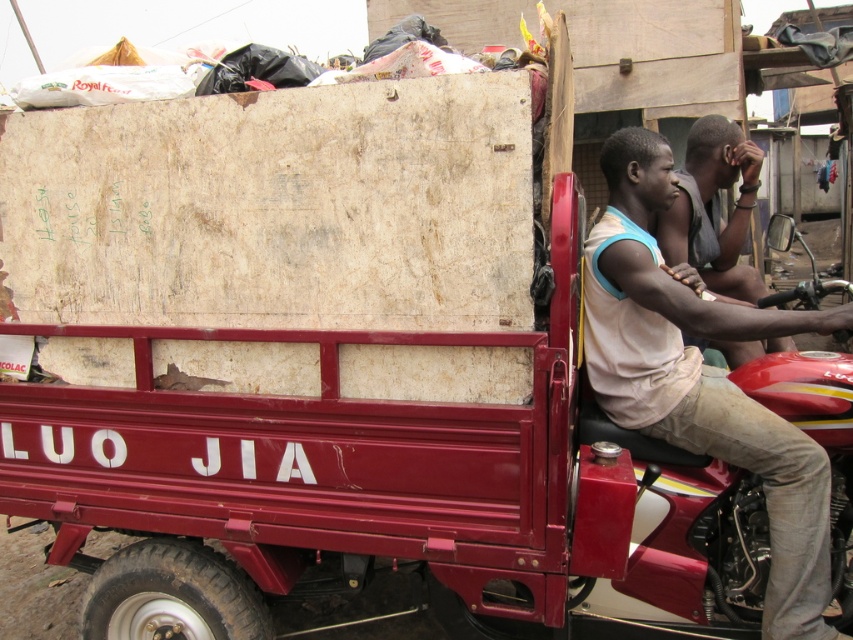
Does light beige cotton shirt at right come behind light brown skin at center?

No.

Between point (708, 371) and point (730, 163), which one is positioned behind?

Point (730, 163)

The image size is (853, 640). Identify the location of light beige cotton shirt at right. (701, 376).